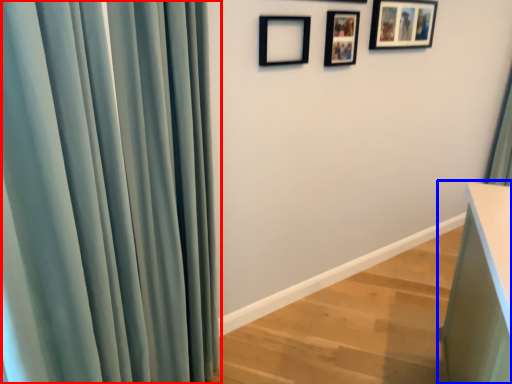
Question: Which point is closer to the camera, curtain (highlighted by a red box) or vanity (highlighted by a blue box)?

Choices:
 (A) curtain
 (B) vanity

Answer: (A)